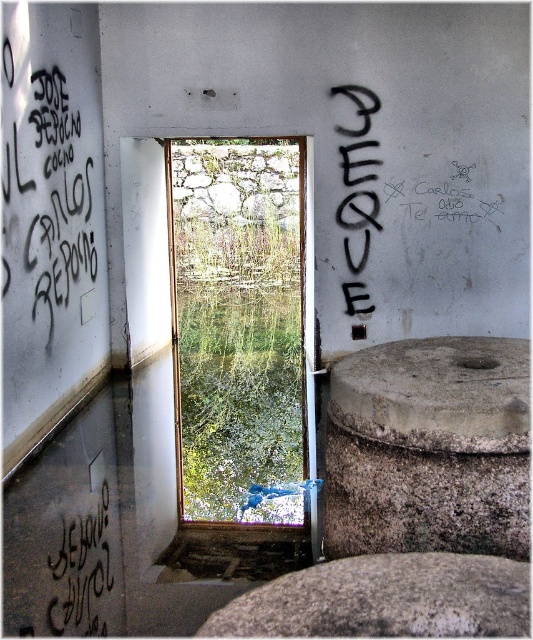
Which of these two, gray rough stone at lower right or black graffiti at lower left, stands shorter?

gray rough stone at lower right

Can you confirm if gray rough stone at lower right is positioned below black graffiti at lower left?

No.

Who is more forward, (405, 608) or (98, 577)?

Positioned in front is point (405, 608).

This screenshot has width=533, height=640. Identify the location of gray rough stone at lower right. (384, 600).

Is wooden frame at center wider than gray rough stone at lower right?

No.

Can you confirm if wooden frame at center is positioned below gray rough stone at lower right?

Yes.

Between point (254, 332) and point (496, 616), which one is positioned behind?

Point (254, 332)

The height and width of the screenshot is (640, 533). In order to click on wooden frame at center in this screenshot , I will do `click(239, 326)`.

In the scene shown: Is wooden frame at center bigger than black graffiti at lower left?

Actually, wooden frame at center might be smaller than black graffiti at lower left.

Is wooden frame at center wider than black graffiti at lower left?

Incorrect, wooden frame at center's width does not surpass black graffiti at lower left's.

Is point (227, 413) positioned behind point (68, 557)?

Yes, it is behind point (68, 557).

In order to click on wooden frame at center in this screenshot , I will do `click(239, 326)`.